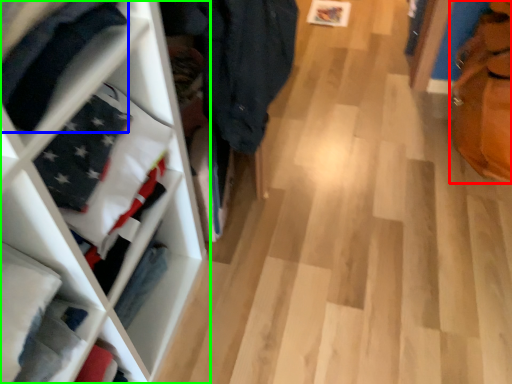
Question: Estimate the real-world distances between objects in this image. Which object is closer to tote bag (highlighted by a red box), clothing (highlighted by a blue box) or shelf (highlighted by a green box)?

Choices:
 (A) clothing
 (B) shelf

Answer: (B)